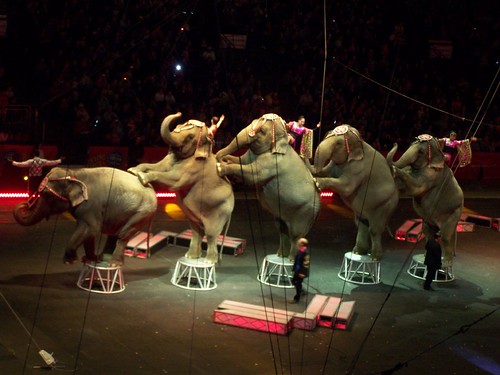
Where is `round stands`? round stands is located at coordinates (277, 260).